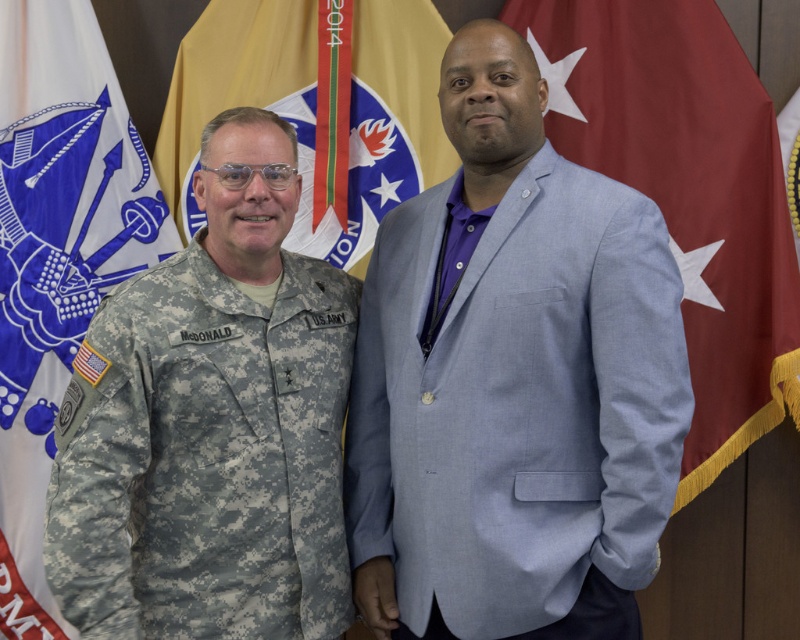
Question: Estimate the real-world distances between objects in this image. Which object is closer to the camouflage fabric uniform at left?

Choices:
 (A) red fabric flag at right
 (B) white fabric flag at left
 (C) light blue fabric blazer at right

Answer: (C)

Question: Can you confirm if light blue fabric blazer at right is wider than camouflage fabric uniform at left?

Choices:
 (A) yes
 (B) no

Answer: (A)

Question: In this image, where is camouflage fabric uniform at left located relative to red fabric flag at right?

Choices:
 (A) left
 (B) right

Answer: (A)

Question: Estimate the real-world distances between objects in this image. Which object is closer to the white fabric flag at left?

Choices:
 (A) light blue fabric blazer at right
 (B) camouflage fabric uniform at left
 (C) red fabric flag at right
 (D) gold textured flag at center

Answer: (D)

Question: Can you confirm if white fabric flag at left is wider than gold textured flag at center?

Choices:
 (A) yes
 (B) no

Answer: (B)

Question: Which object is closer to the camera taking this photo?

Choices:
 (A) white fabric flag at left
 (B) camouflage fabric uniform at left
 (C) red fabric flag at right

Answer: (B)